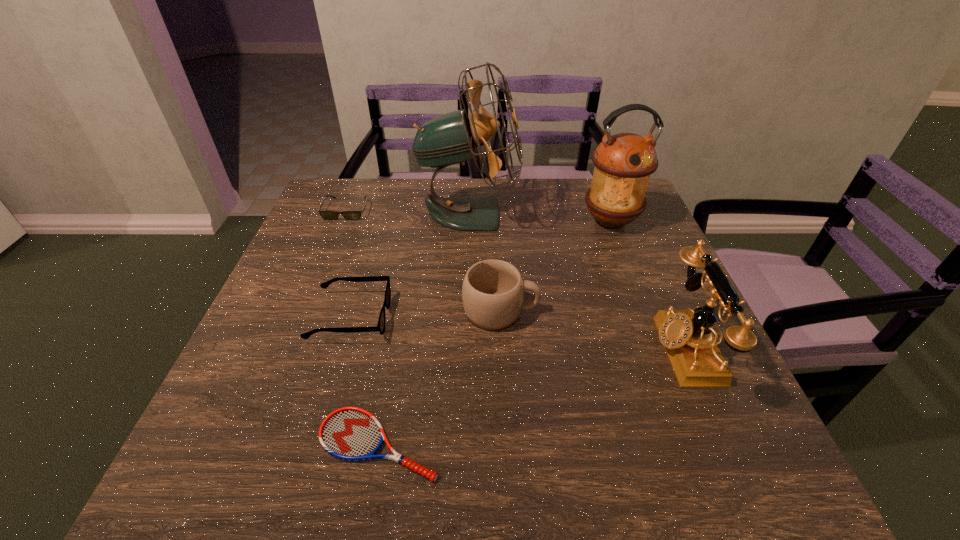
Identify the location of vacant space that satisfies the following two spatial constraints: 1. on the front-facing side of the tallest object for air flow; 2. on the right side of the oil lamp. (468, 220).

Where is `vacant area that satisfies the following two spatial constraints: 1. on the front-facing side of the fan for air flow; 2. on the right side of the oil lamp`? vacant area that satisfies the following two spatial constraints: 1. on the front-facing side of the fan for air flow; 2. on the right side of the oil lamp is located at coordinates (468, 220).

Locate an element on the screen. vacant space that satisfies the following two spatial constraints: 1. on the front-facing side of the tallest object for air flow; 2. on the right side of the oil lamp is located at coordinates (468, 220).